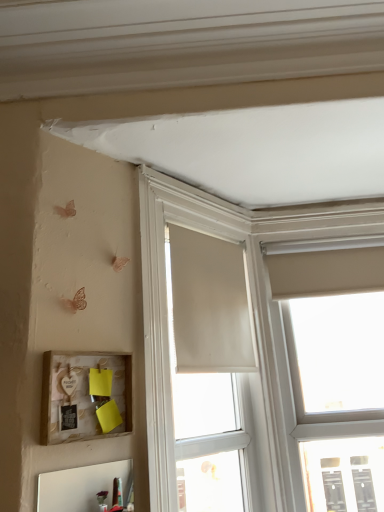
Question: Considering the relative positions of matte white window at upper right, positioned as the 1th window in right-to-left order, and matte white window at center, which ranks as the 1th window in left-to-right order, in the image provided, is matte white window at upper right, positioned as the 1th window in right-to-left order, to the left of matte white window at center, which ranks as the 1th window in left-to-right order, from the viewer's perspective?

Choices:
 (A) yes
 (B) no

Answer: (B)

Question: Does matte white window at upper right, the 2th window in the left-to-right sequence, come in front of matte white window at center, the second window when ordered from right to left?

Choices:
 (A) no
 (B) yes

Answer: (A)

Question: Can you confirm if matte white window at upper right, positioned as the 1th window in right-to-left order, is shorter than matte white window at center, which ranks as the 1th window in left-to-right order?

Choices:
 (A) yes
 (B) no

Answer: (B)

Question: Is matte white window at upper right, the 2th window in the left-to-right sequence, not near matte white window at center, which ranks as the 1th window in left-to-right order?

Choices:
 (A) yes
 (B) no

Answer: (B)

Question: From the image's perspective, does matte white window at upper right, positioned as the 1th window in right-to-left order, appear higher than matte white window at center, which ranks as the 1th window in left-to-right order?

Choices:
 (A) no
 (B) yes

Answer: (A)

Question: Is beige fabric curtain at center in front of or behind matte white window at center, which ranks as the 1th window in left-to-right order, in the image?

Choices:
 (A) front
 (B) behind

Answer: (B)

Question: Considering the positions of beige fabric curtain at center and matte white window at center, the second window when ordered from right to left, in the image, is beige fabric curtain at center taller or shorter than matte white window at center, the second window when ordered from right to left,?

Choices:
 (A) short
 (B) tall

Answer: (A)

Question: Looking at the image, does beige fabric curtain at center seem bigger or smaller compared to matte white window at center, which ranks as the 1th window in left-to-right order?

Choices:
 (A) big
 (B) small

Answer: (B)

Question: From the image's perspective, is beige fabric curtain at center above or below matte white window at center, the second window when ordered from right to left?

Choices:
 (A) below
 (B) above

Answer: (B)

Question: Considering the relative positions of matte white window at upper right, the 2th window in the left-to-right sequence, and beige fabric curtain at center in the image provided, is matte white window at upper right, the 2th window in the left-to-right sequence, to the left or to the right of beige fabric curtain at center?

Choices:
 (A) left
 (B) right

Answer: (B)

Question: Is point (365, 260) positioned closer to the camera than point (173, 291)?

Choices:
 (A) closer
 (B) farther

Answer: (B)

Question: Considering the positions of matte white window at upper right, the 2th window in the left-to-right sequence, and beige fabric curtain at center in the image, is matte white window at upper right, the 2th window in the left-to-right sequence, taller or shorter than beige fabric curtain at center?

Choices:
 (A) short
 (B) tall

Answer: (B)

Question: From a real-world perspective, is matte white window at upper right, the 2th window in the left-to-right sequence, physically located above or below beige fabric curtain at center?

Choices:
 (A) below
 (B) above

Answer: (A)

Question: In terms of width, does beige fabric curtain at center look wider or thinner when compared to matte white window at upper right, the 2th window in the left-to-right sequence?

Choices:
 (A) thin
 (B) wide

Answer: (A)

Question: Does point (233, 348) appear closer or farther from the camera than point (322, 317)?

Choices:
 (A) farther
 (B) closer

Answer: (B)